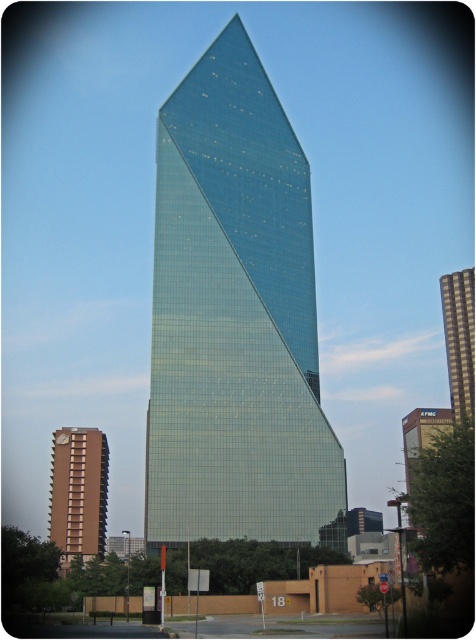
Question: Estimate the real-world distances between objects in this image. Which object is closer to the green glass skyscraper at center?

Choices:
 (A) brown concrete building at lower left
 (B) glassy teal skyscraper at right
 (C) glassy teal skyscraper at center

Answer: (B)

Question: Which point is farther to the camera?

Choices:
 (A) (198, 362)
 (B) (89, 490)
 (C) (467, 380)
 (D) (424, 410)

Answer: (D)

Question: Estimate the real-world distances between objects in this image. Which object is closer to the brown concrete building at lower left?

Choices:
 (A) glassy teal skyscraper at right
 (B) green glass skyscraper at center
 (C) glassy teal skyscraper at center

Answer: (C)

Question: Is brown concrete building at lower left to the right of green glass skyscraper at center from the viewer's perspective?

Choices:
 (A) no
 (B) yes

Answer: (A)

Question: Is brown concrete building at lower left smaller than glassy teal skyscraper at right?

Choices:
 (A) yes
 (B) no

Answer: (B)

Question: Is glassy teal skyscraper at right below green glass skyscraper at center?

Choices:
 (A) yes
 (B) no

Answer: (B)